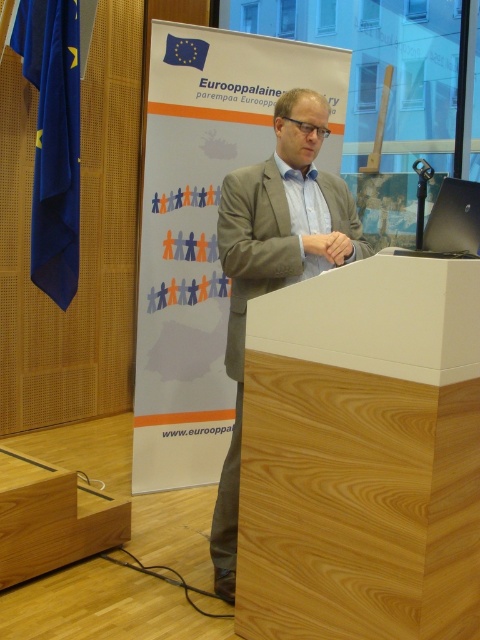
Question: Observing the image, what is the correct spatial positioning of light brown wood podium at center in reference to light brown suit at center?

Choices:
 (A) below
 (B) above

Answer: (A)

Question: Is light brown suit at center to the right of wooden podium at lower left from the viewer's perspective?

Choices:
 (A) yes
 (B) no

Answer: (A)

Question: Does light brown suit at center lie behind wooden podium at lower left?

Choices:
 (A) yes
 (B) no

Answer: (B)

Question: Among these points, which one is nearest to the camera?

Choices:
 (A) (383, 465)
 (B) (101, 522)

Answer: (A)

Question: Which of these objects is positioned closest to the wooden podium at lower left?

Choices:
 (A) light brown suit at center
 (B) light brown wood podium at center

Answer: (A)

Question: Which point is farther from the camera taking this photo?

Choices:
 (A) (22, 525)
 (B) (337, 209)

Answer: (B)